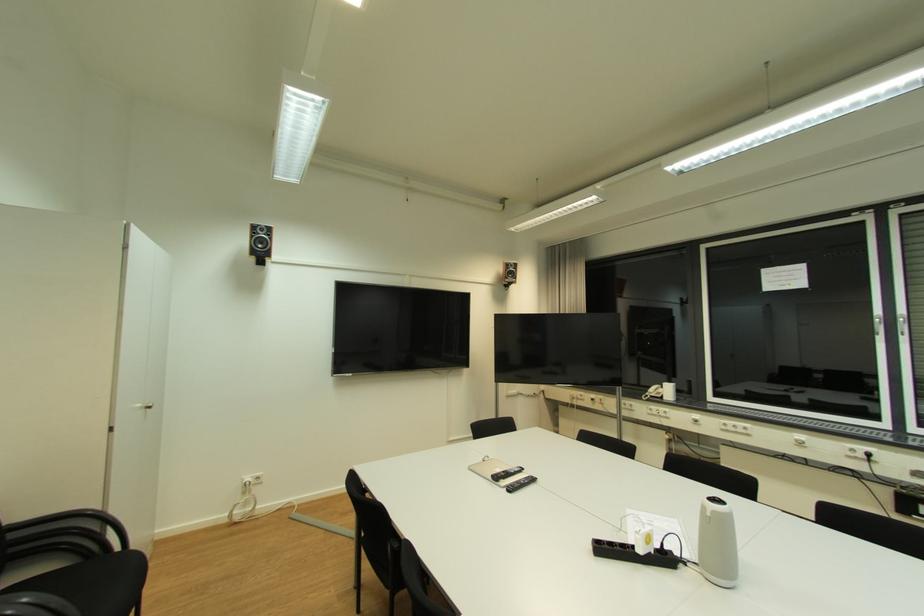
What do you see at coordinates (878, 326) in the screenshot?
I see `the silver window handle` at bounding box center [878, 326].